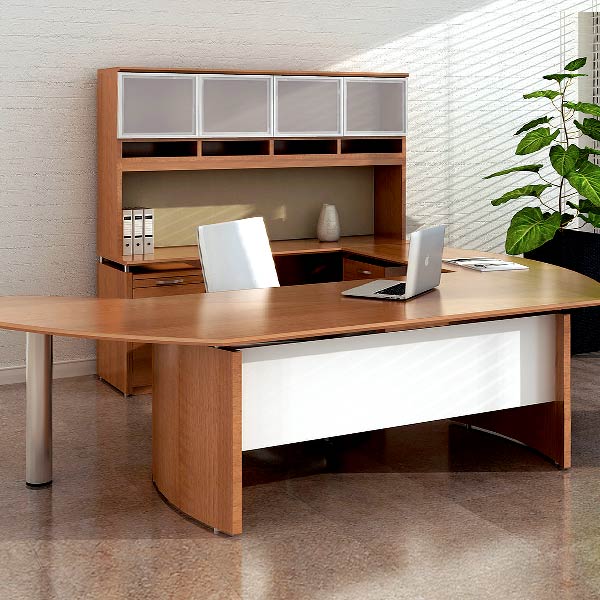
Locate an element on the screen. This screenshot has height=600, width=600. white desk backing is located at coordinates (410, 385).